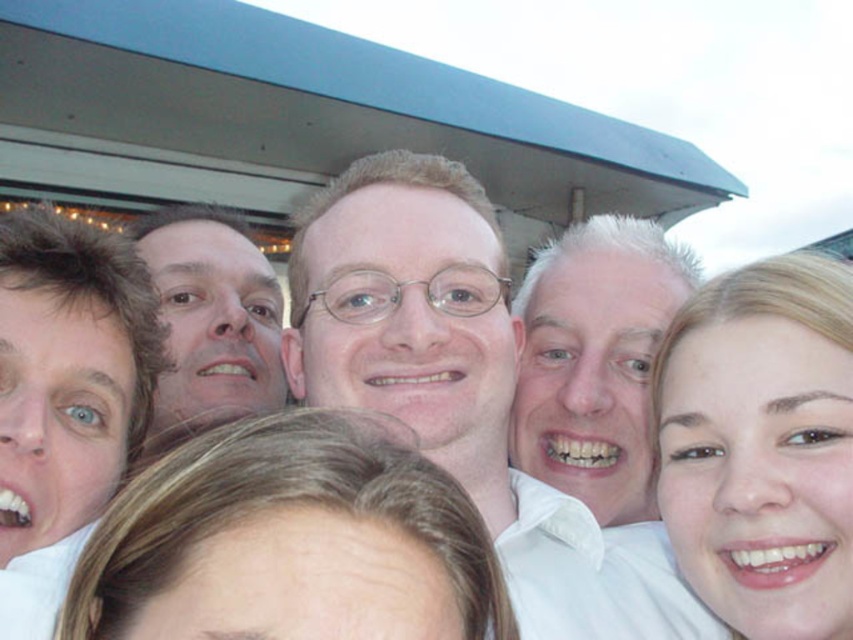
You are a photographer standing at the edge of the pavilion. You want to take a group photo of the six people. The white glossy shirt at center is currently 6.25 feet away from you. Can you fit all six people into your camera frame if your camera has a maximum focus range of 6 feet?

The white glossy shirt at center is 6.25 feet away from you, which exceeds the camera maximum focus range of 6 feet. Therefore, you cannot fit all six people into your camera frame.

From the picture: You are taking a photo of two people in the center of the group. The first person has smooth skin face at center and the second has blonde hair at center. From the perspective of the photographer, which person is positioned to the right of the other?

The blonde hair at center is positioned to the right of the smooth skin face at center.

You are standing in front of the group of six people taking a selfie under the blue roof. You want to determine which of the two points, point (117, 518) or point (172, 276), is closer to you. Which one is closer?

Point (117, 518) is closer to the viewer than point (172, 276).